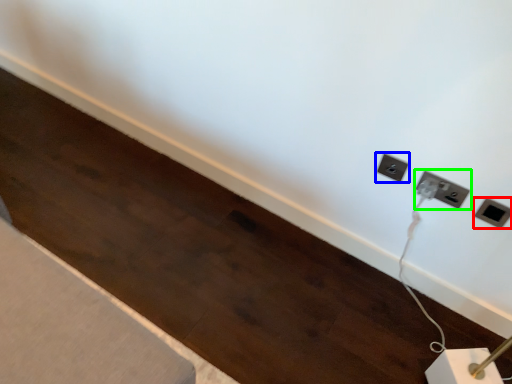
Question: Which object is the farthest from power plugs and sockets (highlighted by a red box)? Choose among these: power plugs and sockets (highlighted by a blue box) or power plugs and sockets (highlighted by a green box).

Choices:
 (A) power plugs and sockets
 (B) power plugs and sockets

Answer: (A)